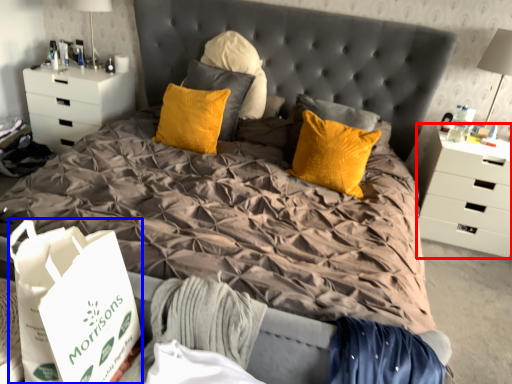
Question: Among these objects, which one is farthest to the camera, chest of drawers (highlighted by a red box) or shopping bag (highlighted by a blue box)?

Choices:
 (A) chest of drawers
 (B) shopping bag

Answer: (A)